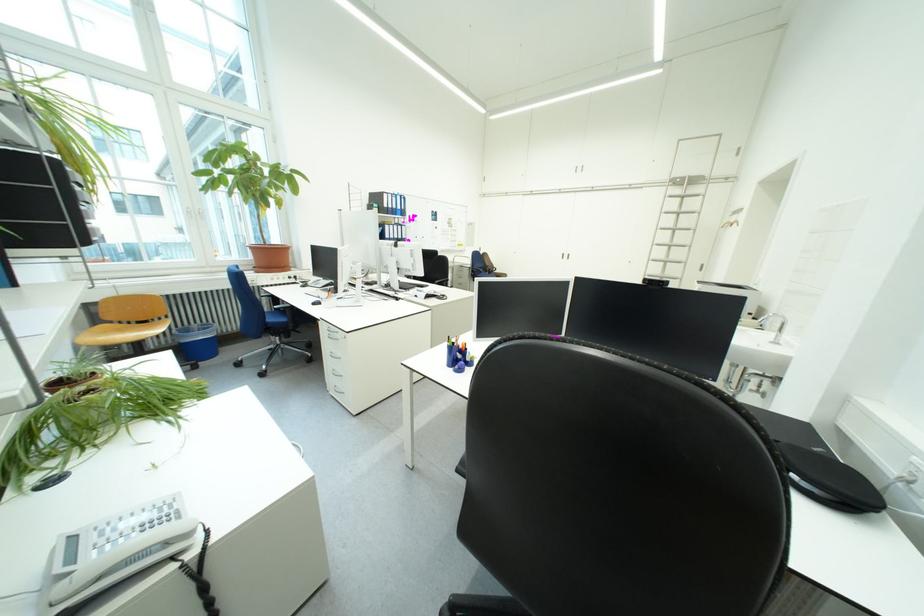
This screenshot has height=616, width=924. I want to click on blue trash bin, so click(197, 342).